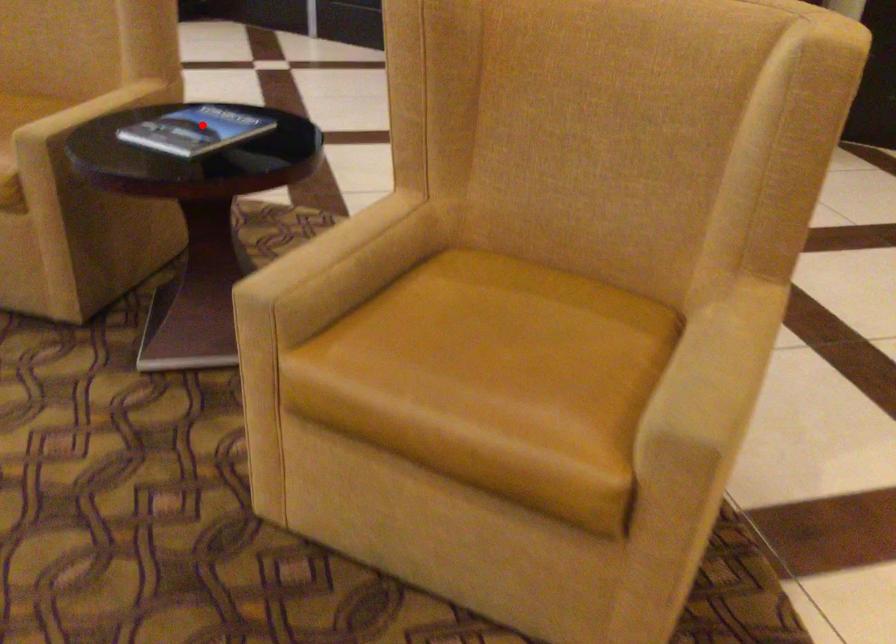
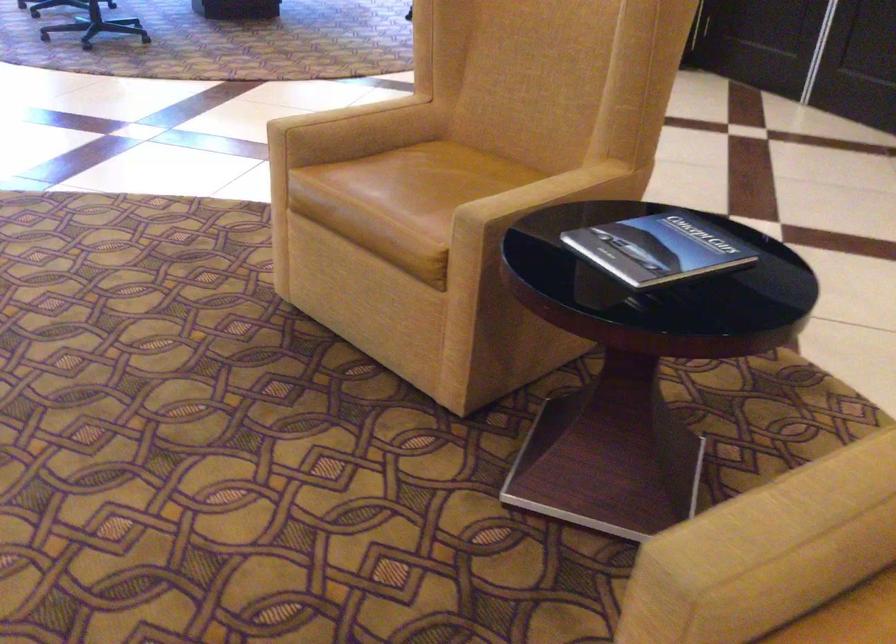
Question: I am providing you with two images of the same scene from different viewpoints. In image1, a red point is highlighted. Considering the same 3D point in image2, which of the following is correct?

Choices:
 (A) It is closer
 (B) It is farther

Answer: (A)